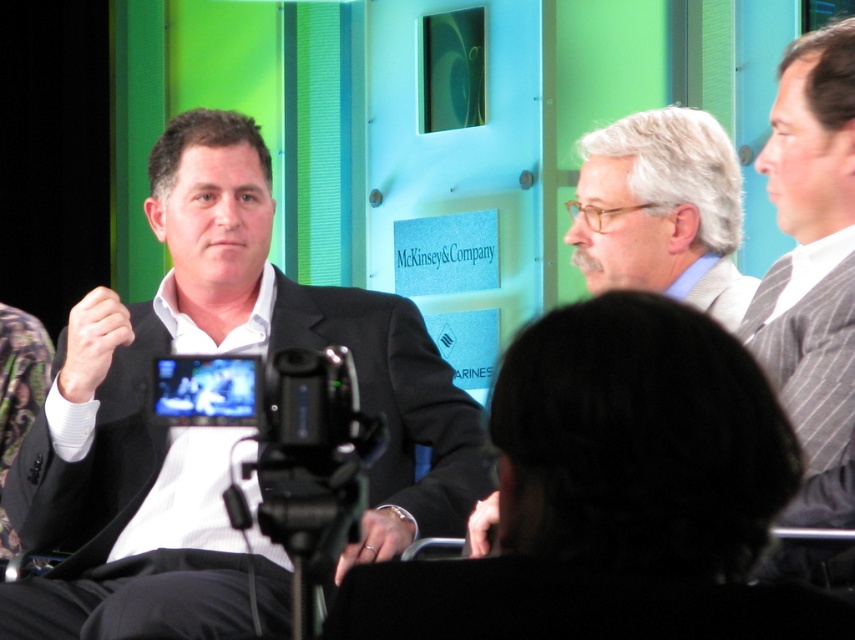
You are organizing a photo shoot and need to arrange two subjects in a row. The first subject is wearing a black matte suit at center, and the second is wearing a gray striped sweater at right. Given their sizes, which subject should you place on the left to ensure they both fit within the frame?

The black matte suit at center is wider than the gray striped sweater at right, so placing the black matte suit at center on the left would allow both subjects to fit within the frame as it takes up more space.

You are organizing a photo shoot and need to arrange two models wearing the black matte suit at center and the gray textured suit at center. Based on their heights, which model should stand in front to ensure both are visible in the photo?

The gray textured suit at center should stand in front because the black matte suit at center is taller. This way, the taller model can be positioned behind without blocking the shorter one, ensuring both are visible in the photo.